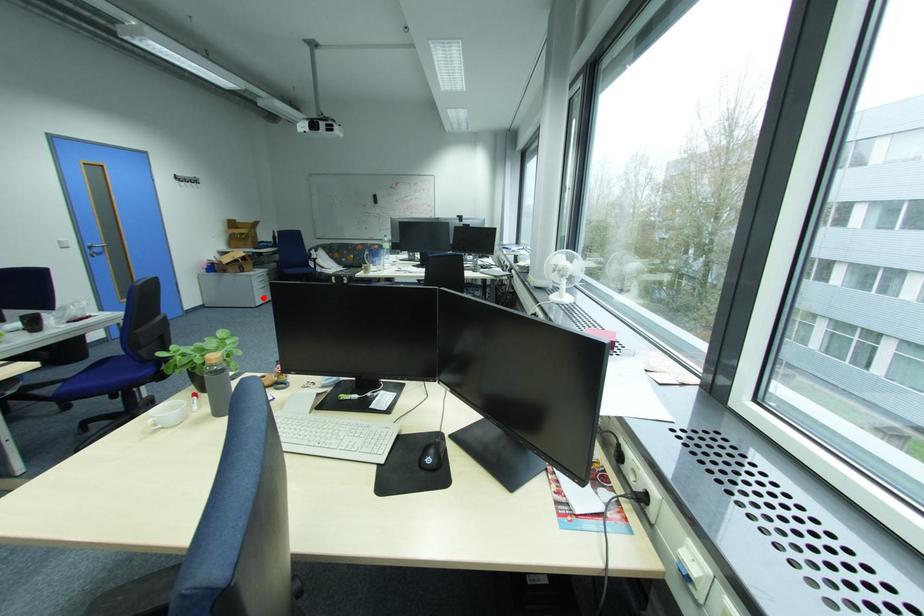
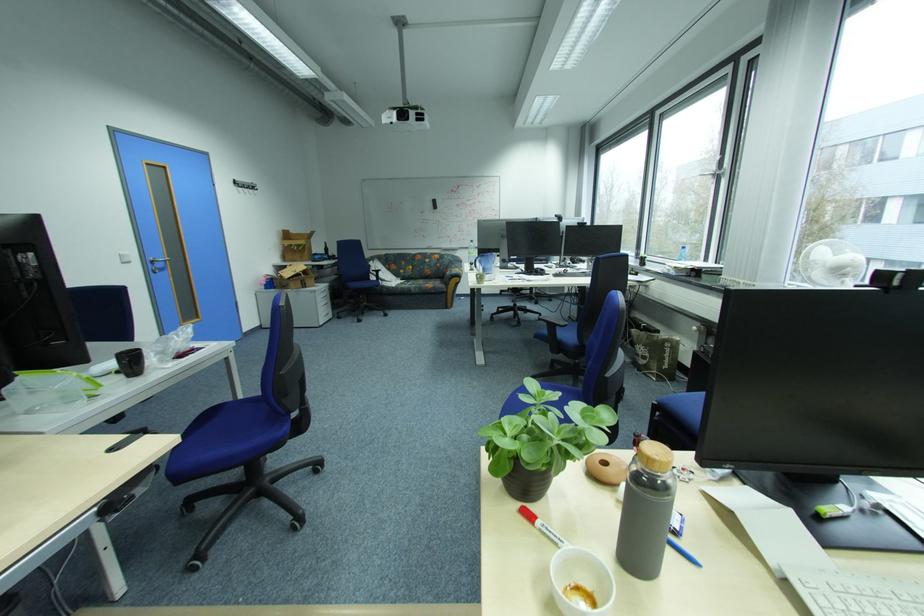
Where in the second image is the point corresponding to the highlighted location from the first image?

(326, 315)